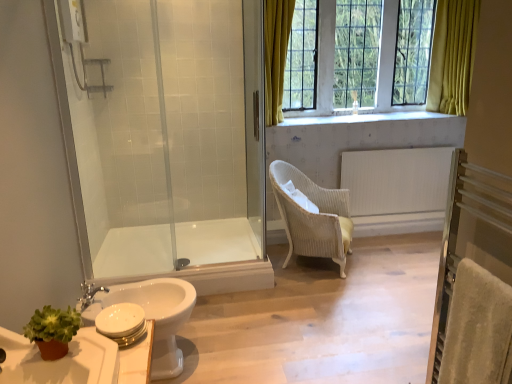
You are a GUI agent. You are given a task and a screenshot of the screen. Output one action in this format:
    pyautogui.click(x=<x>, y=<y>)
    Task: Click on the free space in front of clear glass shower door at center
    The height and width of the screenshot is (384, 512).
    Given the screenshot: What is the action you would take?
    pyautogui.click(x=241, y=250)